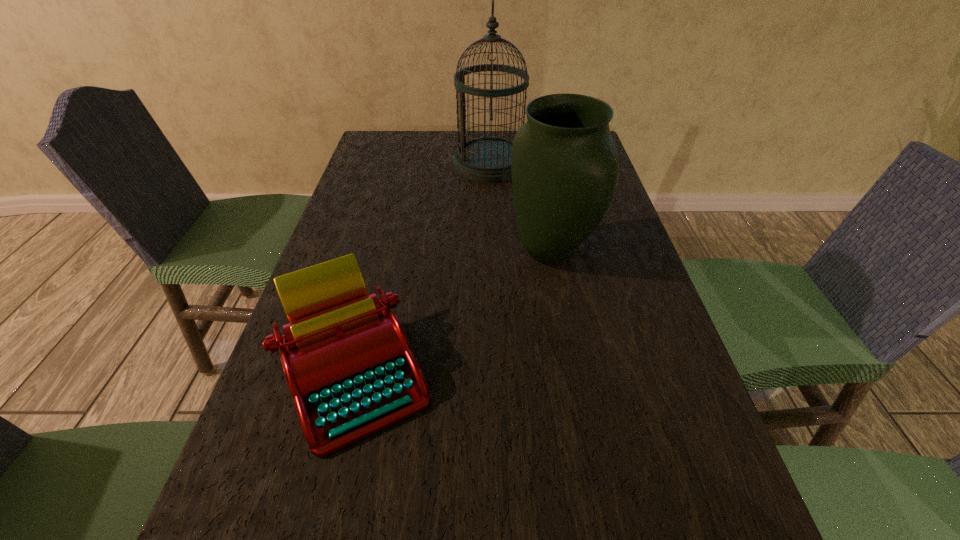
Find the location of `vacant space located 0.060m on the typing side of the leftmost object`. vacant space located 0.060m on the typing side of the leftmost object is located at coordinates (324, 498).

Identify the location of object present at the far edge. This screenshot has height=540, width=960. pyautogui.click(x=487, y=159).

What are the coordinates of `object present at the left edge` in the screenshot? It's located at (346, 358).

Locate an element on the screen. object that is at the right edge is located at coordinates (564, 165).

Find the location of `free location at the left edge of the desktop`. free location at the left edge of the desktop is located at coordinates (371, 264).

Identify the location of blank space at the right edge of the desktop. (657, 363).

In the image, there is a desktop. Where is `vacant space at the far left corner`? This screenshot has width=960, height=540. vacant space at the far left corner is located at coordinates (385, 139).

Locate an element on the screen. This screenshot has width=960, height=540. empty space between the nearest object and the vase is located at coordinates (452, 312).

Identify the location of vacant space that's between the second nearest object and the leftmost object. (452, 312).

Identify the location of vacant area between the leftmost object and the farthest object. The height and width of the screenshot is (540, 960). (422, 268).